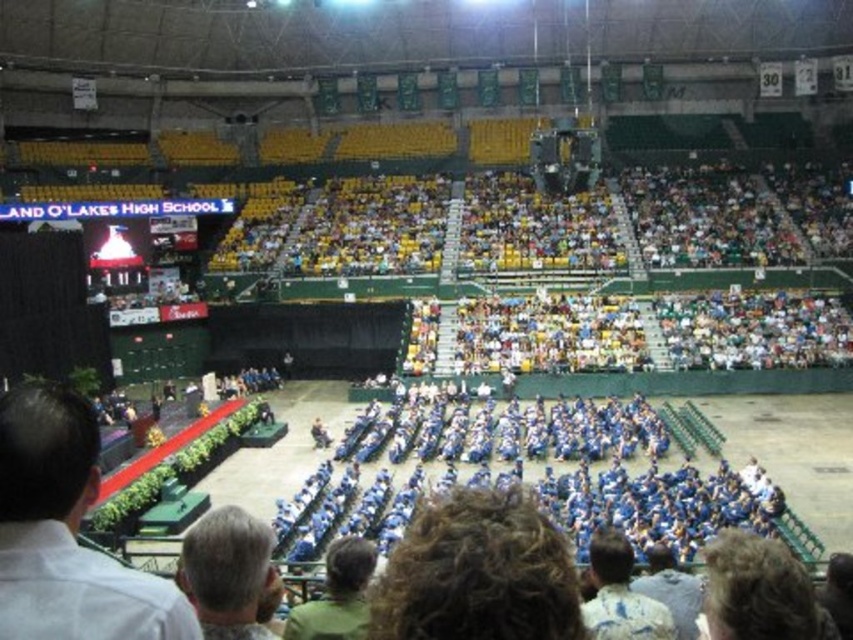
Can you confirm if curly hair at center is positioned to the left of blue uniform at lower right?

Indeed, curly hair at center is positioned on the left side of blue uniform at lower right.

Is curly hair at center above blue uniform at lower right?

Correct, curly hair at center is located above blue uniform at lower right.

The width and height of the screenshot is (853, 640). Identify the location of curly hair at center. (477, 572).

Find the location of a particular element. The height and width of the screenshot is (640, 853). curly hair at center is located at coordinates (477, 572).

Which of these two, dark brown hair at lower right or blue uniform at lower right, stands shorter?

With less height is blue uniform at lower right.

This screenshot has width=853, height=640. Find the location of `dark brown hair at lower right`. dark brown hair at lower right is located at coordinates (759, 589).

Where is `dark brown hair at lower right`? dark brown hair at lower right is located at coordinates (759, 589).

Which is in front, point (99, 596) or point (621, 547)?

Point (99, 596) is in front.

Who is shorter, white shirt at lower left or blue uniform at lower right?

white shirt at lower left is shorter.

Between point (21, 589) and point (595, 541), which one is positioned behind?

Positioned behind is point (595, 541).

Identify the location of white shirt at lower left. The height and width of the screenshot is (640, 853). (67, 532).